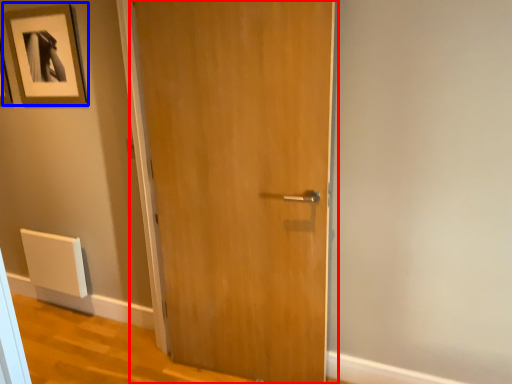
Question: Among these objects, which one is nearest to the camera, door (highlighted by a red box) or picture frame (highlighted by a blue box)?

Choices:
 (A) door
 (B) picture frame

Answer: (A)